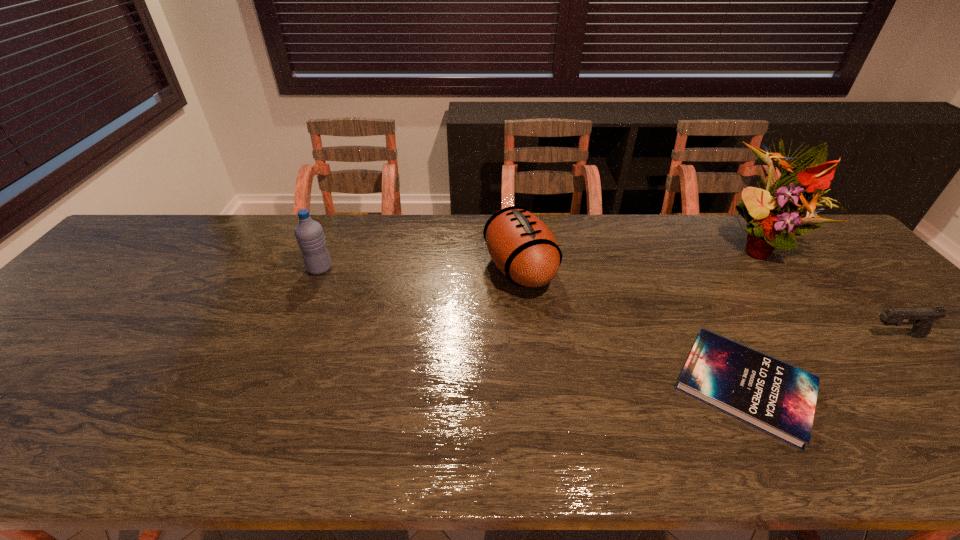
Identify the location of bouquet. This screenshot has width=960, height=540. (772, 215).

This screenshot has height=540, width=960. What are the coordinates of `water bottle` in the screenshot? It's located at (309, 234).

You are a GUI agent. You are given a task and a screenshot of the screen. Output one action in this format:
    pyautogui.click(x=<x>, y=<y>)
    Task: Click on the fourth object from right to left
    The height and width of the screenshot is (540, 960).
    Given the screenshot: What is the action you would take?
    pyautogui.click(x=523, y=248)

This screenshot has width=960, height=540. Identify the location of the third shortest object. 523,248.

This screenshot has width=960, height=540. I want to click on the second shortest object, so click(x=921, y=318).

Identify the location of hardback book. (773, 396).

This screenshot has width=960, height=540. Find the location of `blank area located on the front-facing side of the tallest object`. blank area located on the front-facing side of the tallest object is located at coordinates (849, 361).

Locate an element on the screen. The image size is (960, 540). free point located 0.220m on the back of the water bottle is located at coordinates (341, 219).

At what (x,y) coordinates should I click in order to perform the action: click on vacant space located 0.210m on the left of the third tallest object. Please return your answer as a coordinate pair (x, y). The width and height of the screenshot is (960, 540). Looking at the image, I should click on (411, 268).

Locate an element on the screen. The width and height of the screenshot is (960, 540). vacant region located at the barrel of the pistol is located at coordinates (766, 335).